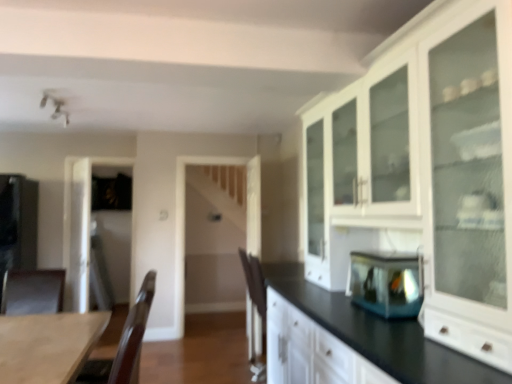
Question: From the image's perspective, is brown leather armchair at lower left, the 1th armchair in the left-to-right sequence, located beneath white glossy cabinet at upper right?

Choices:
 (A) no
 (B) yes

Answer: (B)

Question: Considering the relative positions of brown leather armchair at lower left, marked as the second armchair in a right-to-left arrangement, and white glossy cabinet at upper right in the image provided, is brown leather armchair at lower left, marked as the second armchair in a right-to-left arrangement, behind white glossy cabinet at upper right?

Choices:
 (A) no
 (B) yes

Answer: (B)

Question: Does brown leather armchair at lower left, marked as the second armchair in a right-to-left arrangement, appear on the left side of white glossy cabinet at upper right?

Choices:
 (A) no
 (B) yes

Answer: (B)

Question: Is brown leather armchair at lower left, the 1th armchair in the left-to-right sequence, bigger than white glossy cabinet at upper right?

Choices:
 (A) no
 (B) yes

Answer: (A)

Question: Could you tell me if brown leather armchair at lower left, the 1th armchair in the left-to-right sequence, is turned towards white glossy cabinet at upper right?

Choices:
 (A) yes
 (B) no

Answer: (B)

Question: Relative to wooden table at lower left, is brown leather armchair at lower left, marked as the second armchair in a right-to-left arrangement, in front or behind?

Choices:
 (A) front
 (B) behind

Answer: (B)

Question: Is brown leather armchair at lower left, the 1th armchair in the left-to-right sequence, wider or thinner than wooden table at lower left?

Choices:
 (A) thin
 (B) wide

Answer: (B)

Question: Is point [x=27, y=294] closer or farther from the camera than point [x=5, y=350]?

Choices:
 (A) farther
 (B) closer

Answer: (A)

Question: Is brown leather armchair at lower left, the 1th armchair in the left-to-right sequence, to the left or to the right of wooden table at lower left in the image?

Choices:
 (A) left
 (B) right

Answer: (A)

Question: In terms of width, does transparent glass fish tank at center, positioned as the second appliance in back-to-front order, look wider or thinner when compared to matte black refrigerator at left, the first appliance when ordered from left to right?

Choices:
 (A) thin
 (B) wide

Answer: (A)

Question: Does point click(x=375, y=294) appear closer or farther from the camera than point click(x=9, y=182)?

Choices:
 (A) closer
 (B) farther

Answer: (A)

Question: From their relative heights in the image, would you say transparent glass fish tank at center, arranged as the 1th appliance when viewed from the right, is taller or shorter than matte black refrigerator at left, arranged as the 2th appliance when viewed from the right?

Choices:
 (A) tall
 (B) short

Answer: (B)

Question: Choose the correct answer: Is transparent glass fish tank at center, acting as the second appliance starting from the left, inside matte black refrigerator at left, arranged as the 2th appliance when viewed from the right, or outside it?

Choices:
 (A) outside
 (B) inside

Answer: (A)

Question: From the image's perspective, relative to wooden table at lower left, is matte black refrigerator at left, the first appliance when ordered from left to right, above or below?

Choices:
 (A) below
 (B) above

Answer: (B)

Question: Considering the positions of matte black refrigerator at left, the first appliance when ordered from left to right, and wooden table at lower left in the image, is matte black refrigerator at left, the first appliance when ordered from left to right, wider or thinner than wooden table at lower left?

Choices:
 (A) thin
 (B) wide

Answer: (B)